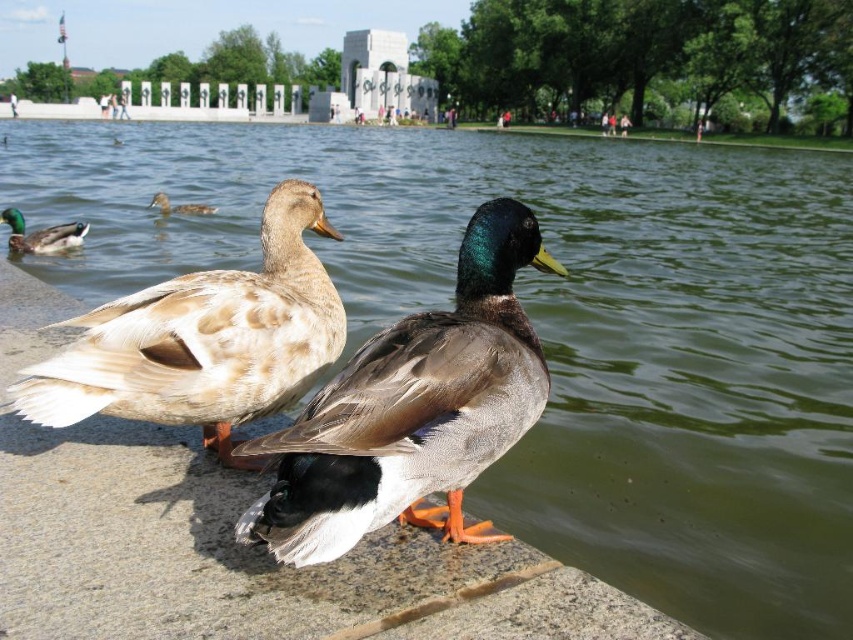
You are a birdwatcher observing two ducks in a park. You notice a brown feathered duck at center and a green glossy duck at left. Which duck is wider?

The brown feathered duck at center is wider than the green glossy duck at left.

You are a park visitor who wants to take a photo of the brown matte duck at upper left and the light brown leather jacket at upper center. Which object should you zoom in more on to capture both in the frame?

You should zoom in more on the light brown leather jacket at upper center because the brown matte duck at upper left is smaller than it, allowing both to fit within the frame when focusing on the larger object.

You are standing in the park and see the brown feathered duck at center. If you want to approach it without disturbing it, what is the minimum distance you need to maintain?

The minimum distance you need to maintain is 2.30 meters from the brown feathered duck at center to approach it without disturbing it.